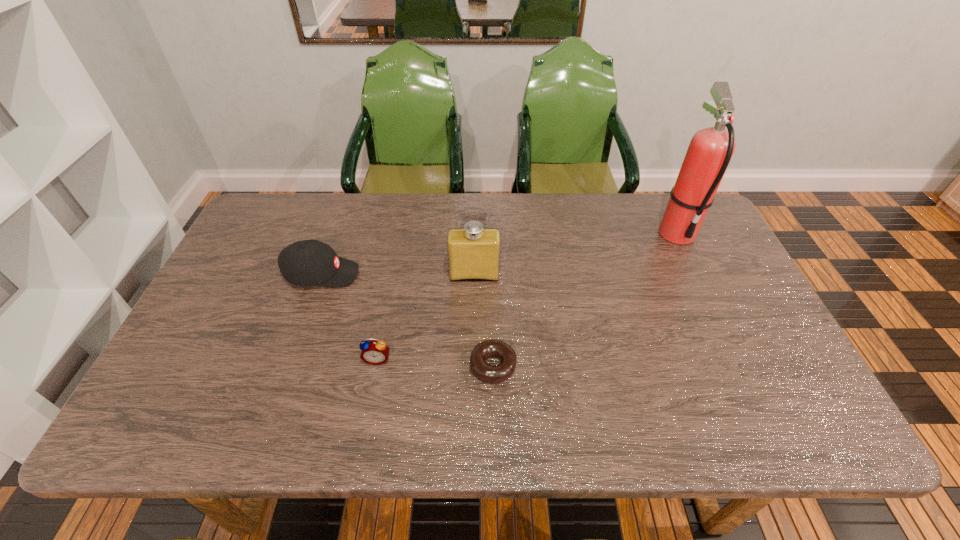
Locate an element on the screen. This screenshot has height=540, width=960. free region located 0.360m with a logo on the front of the leftmost object is located at coordinates (484, 274).

The height and width of the screenshot is (540, 960). In order to click on vacant space located on the front-facing side of the alarm clock in this screenshot , I will do `click(365, 425)`.

Identify the location of vacant region located on the back of the shortest object. This screenshot has width=960, height=540. (492, 298).

The image size is (960, 540). Find the location of `object that is at the far edge`. object that is at the far edge is located at coordinates pos(709,153).

I want to click on object situated at the right edge, so click(709, 153).

At what (x,y) coordinates should I click in order to perform the action: click on object located in the far right corner section of the desktop. Please return your answer as a coordinate pair (x, y). Looking at the image, I should click on (709, 153).

This screenshot has width=960, height=540. What are the coordinates of `vacant area at the far edge` in the screenshot? It's located at (446, 212).

This screenshot has width=960, height=540. I want to click on blank space at the near edge of the desktop, so click(398, 425).

You are a GUI agent. You are given a task and a screenshot of the screen. Output one action in this format:
    pyautogui.click(x=<x>, y=<y>)
    Task: Click on the vacant space at the left edge
    The image size is (960, 540).
    Given the screenshot: What is the action you would take?
    pyautogui.click(x=209, y=307)

You are a GUI agent. You are given a task and a screenshot of the screen. Output one action in this format:
    pyautogui.click(x=<x>, y=<y>)
    Task: Click on the free location at the right edge of the desktop
    Image resolution: width=960 pixels, height=540 pixels.
    Given the screenshot: What is the action you would take?
    pyautogui.click(x=778, y=382)